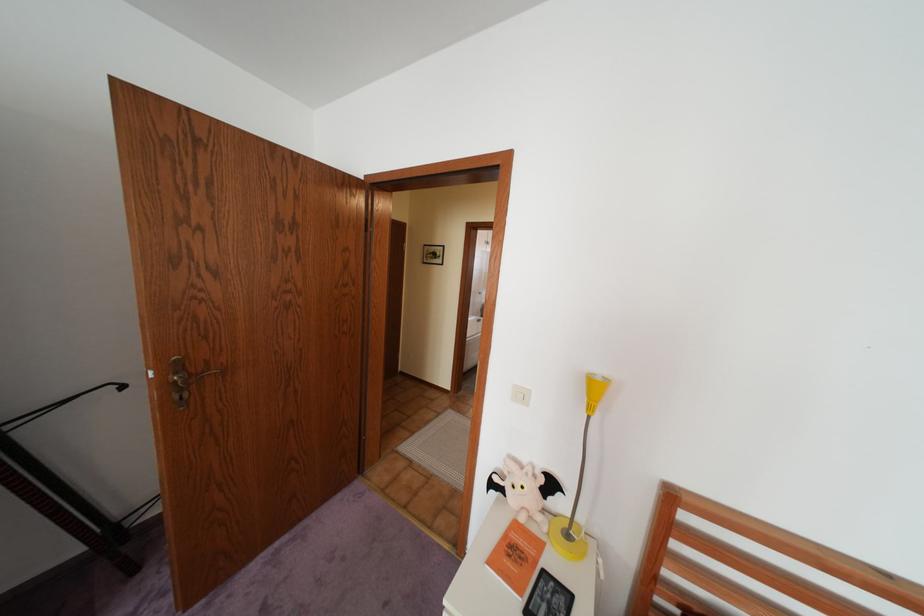
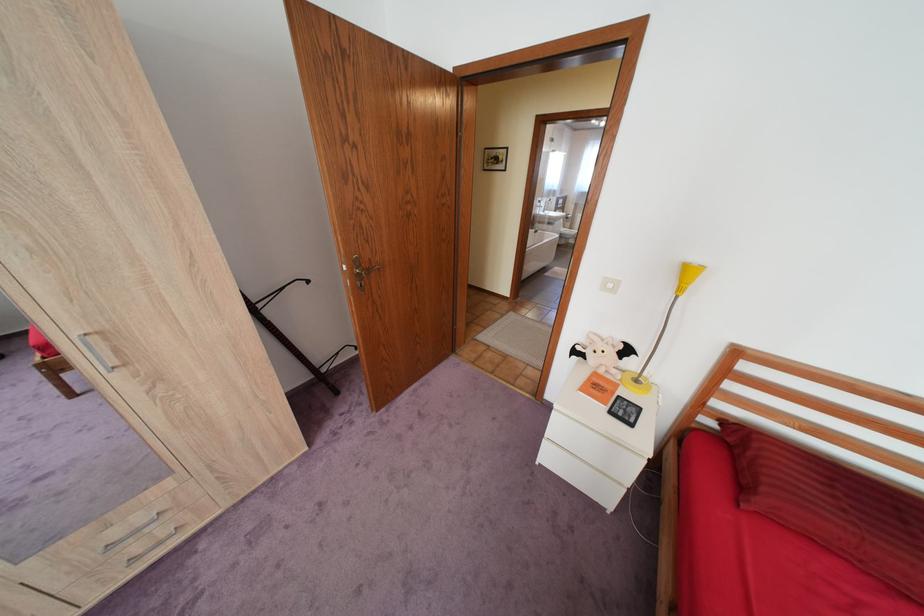
Locate, in the second image, the point that corresponds to pixel 578 535 in the first image.

(648, 379)